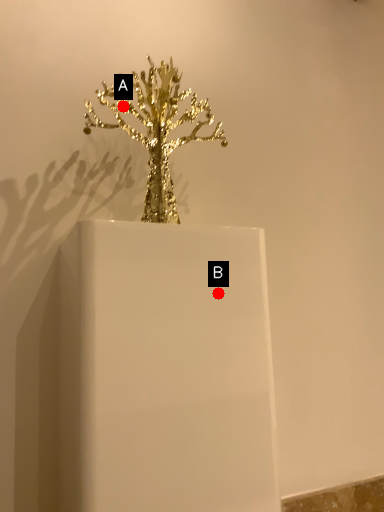
Question: Two points are circled on the image, labeled by A and B beside each circle. Which point is closer to the camera taking this photo?

Choices:
 (A) A is closer
 (B) B is closer

Answer: (B)